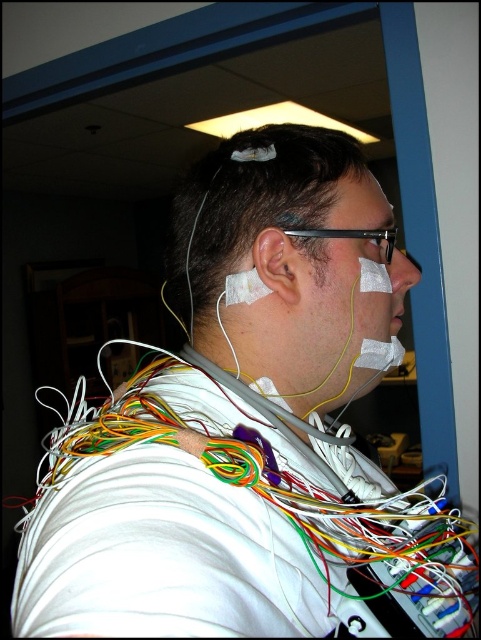
You are a medical technician assessing the placement of electrodes on a patient. You notice two areas of skin marked as matte skin ear at center and matte skin at upper center. Which of these two areas is positioned closer to your viewpoint as you examine the patient?

The matte skin ear at center is positioned closer to the viewer than the matte skin at upper center.